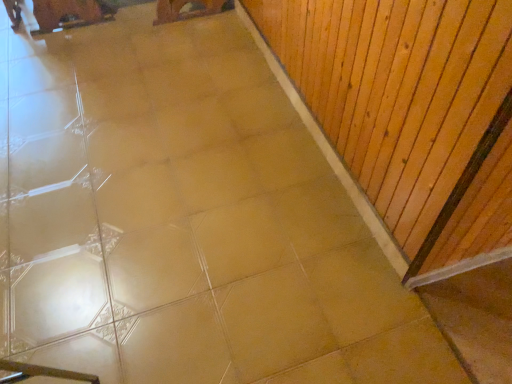
Find the location of a particular element. This screenshot has width=512, height=384. vacant space situated above natural wood plywood at upper right (from a real-world perspective) is located at coordinates (303, 95).